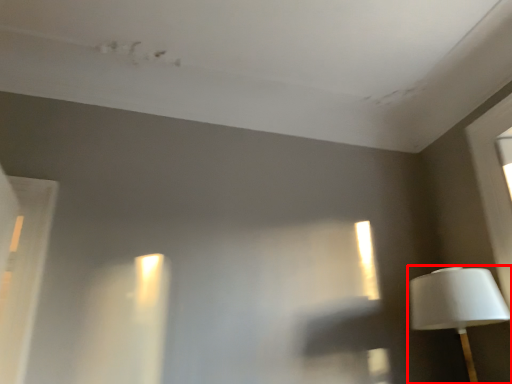
Question: From the image, what is the correct spatial relationship of lamp (annotated by the red box) in relation to window?

Choices:
 (A) left
 (B) right

Answer: (B)